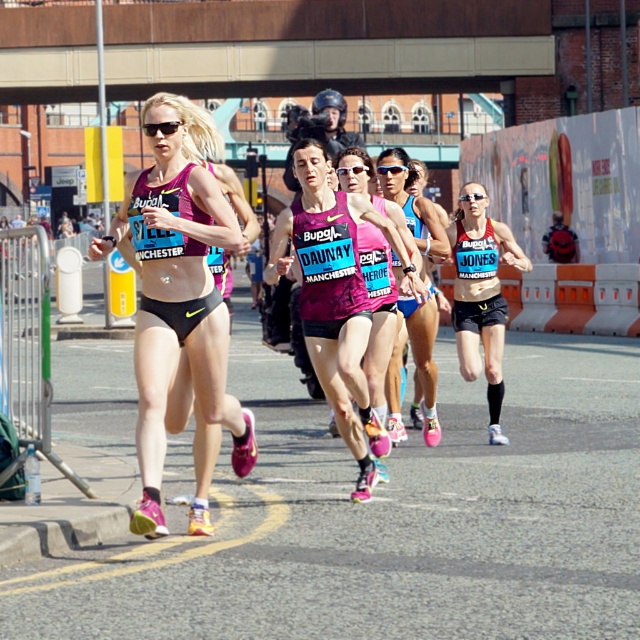
Which is more to the right, matte pink running suit at left or black matte bikini top at center?

black matte bikini top at center

Does point (173, 129) come farther from viewer compared to point (488, 436)?

No, (173, 129) is in front of (488, 436).

Where is `matte pink running suit at left`? The height and width of the screenshot is (640, 640). matte pink running suit at left is located at coordinates (177, 296).

Between matte pink shorts at center and pink fabric tank top at center, which one appears on the left side from the viewer's perspective?

pink fabric tank top at center

Can you confirm if matte pink shorts at center is bigger than pink fabric tank top at center?

Yes, matte pink shorts at center is bigger than pink fabric tank top at center.

Identify the location of matte pink shorts at center. The height and width of the screenshot is (640, 640). (412, 205).

This screenshot has width=640, height=640. In order to click on matte pink shorts at center in this screenshot , I will do `click(412, 205)`.

Is matte pink running suit at left shorter than matte pink shorts at center?

In fact, matte pink running suit at left may be taller than matte pink shorts at center.

Is matte pink running suit at left closer to camera compared to matte pink shorts at center?

Yes, matte pink running suit at left is in front of matte pink shorts at center.

Which is behind, point (147, 406) or point (392, 150)?

Positioned behind is point (392, 150).

Where is `matte pink running suit at left`? The width and height of the screenshot is (640, 640). matte pink running suit at left is located at coordinates (177, 296).